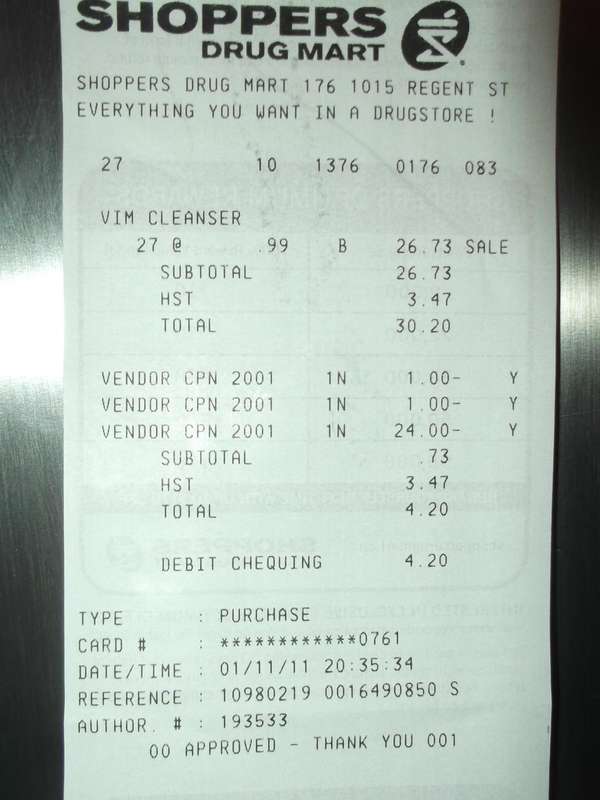
Where is `surface`? surface is located at coordinates (564, 412).